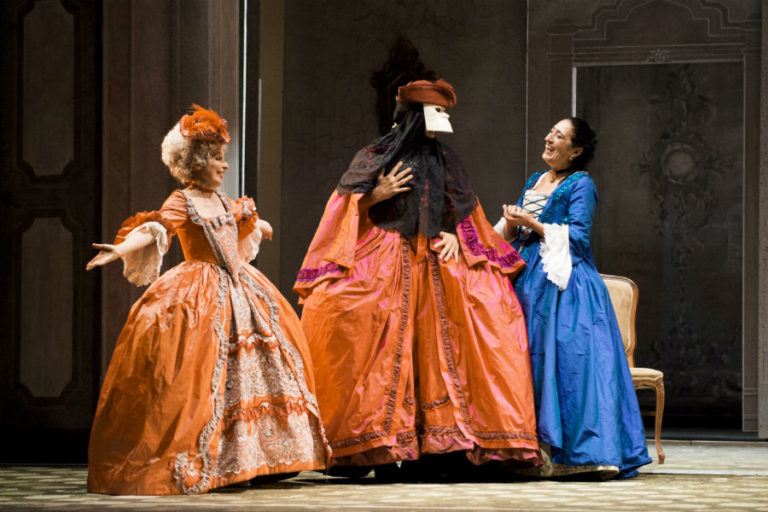
Locate an element on the screen. Image resolution: width=768 pixels, height=512 pixels. wall is located at coordinates (611, 71).